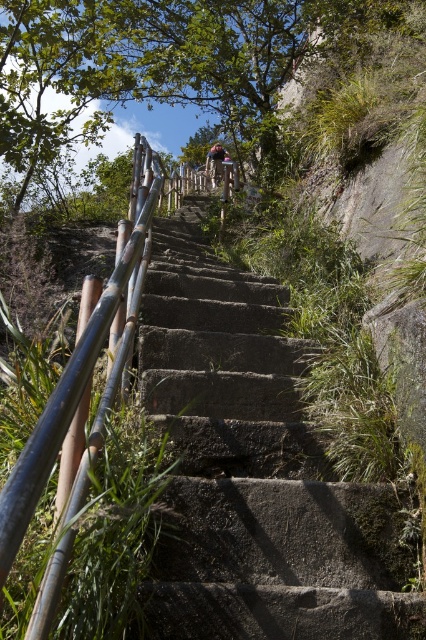
Question: Which object is the closest to the dark gray concrete stairs at center?

Choices:
 (A) blue denim jeans at center
 (B) brown bamboo rail at left

Answer: (B)

Question: Does dark gray concrete stairs at center appear over brown bamboo rail at left?

Choices:
 (A) no
 (B) yes

Answer: (A)

Question: Is brown bamboo rail at left thinner than blue denim jeans at center?

Choices:
 (A) no
 (B) yes

Answer: (B)

Question: Which object appears closest to the camera in this image?

Choices:
 (A) brown bamboo rail at left
 (B) dark gray concrete stairs at center
 (C) blue denim jeans at center

Answer: (A)

Question: Based on their relative distances, which object is farther from the blue denim jeans at center?

Choices:
 (A) dark gray concrete stairs at center
 (B) brown bamboo rail at left

Answer: (A)

Question: Can you confirm if brown bamboo rail at left is positioned to the left of blue denim jeans at center?

Choices:
 (A) no
 (B) yes

Answer: (B)